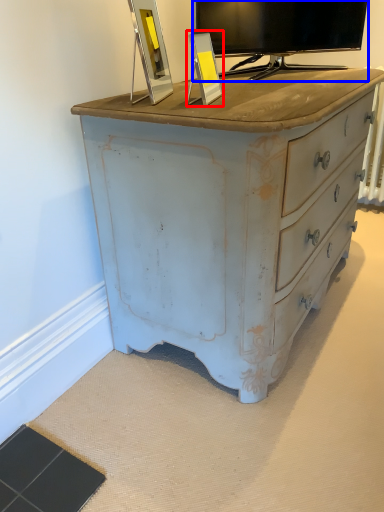
Question: Among these objects, which one is farthest to the camera, picture frame (highlighted by a red box) or television (highlighted by a blue box)?

Choices:
 (A) picture frame
 (B) television

Answer: (B)